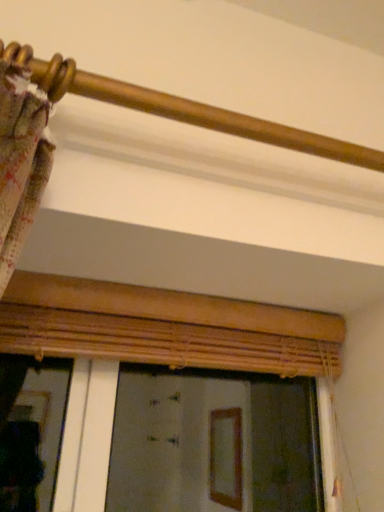
What is the approximate height of wooden blinds at center?

wooden blinds at center is 18.01 inches in height.

The height and width of the screenshot is (512, 384). What do you see at coordinates (165, 327) in the screenshot?
I see `wooden blinds at center` at bounding box center [165, 327].

Measure the distance between wooden blinds at center and camera.

The depth of wooden blinds at center is 82.97 centimeters.

This screenshot has height=512, width=384. In order to click on wooden blinds at center in this screenshot , I will do `click(165, 327)`.

I want to click on gold polished rod at upper center, so click(181, 108).

The width and height of the screenshot is (384, 512). Describe the element at coordinates (181, 108) in the screenshot. I see `gold polished rod at upper center` at that location.

Find the location of a particular element. wooden blinds at center is located at coordinates (165, 327).

Based on the photo, considering the relative positions of wooden blinds at center and gold polished rod at upper center in the image provided, is wooden blinds at center to the left of gold polished rod at upper center from the viewer's perspective?

Yes, wooden blinds at center is to the left of gold polished rod at upper center.

Considering the positions of objects wooden blinds at center and gold polished rod at upper center in the image provided, who is in front, wooden blinds at center or gold polished rod at upper center?

gold polished rod at upper center is closer to the camera.

Is point (264, 314) positioned behind point (332, 154)?

Yes, point (264, 314) is behind point (332, 154).

From the image's perspective, is wooden blinds at center under gold polished rod at upper center?

Indeed, from the image's perspective, wooden blinds at center is shown beneath gold polished rod at upper center.

From a real-world perspective, between wooden blinds at center and gold polished rod at upper center, who is vertically higher?

In real-world perspective, gold polished rod at upper center is above.

Does wooden blinds at center have a greater width compared to gold polished rod at upper center?

Correct, the width of wooden blinds at center exceeds that of gold polished rod at upper center.

Can you confirm if wooden blinds at center is taller than gold polished rod at upper center?

Correct, wooden blinds at center is much taller as gold polished rod at upper center.

Considering the relative sizes of wooden blinds at center and gold polished rod at upper center in the image provided, is wooden blinds at center smaller than gold polished rod at upper center?

No, wooden blinds at center is not smaller than gold polished rod at upper center.

In the scene shown: Is gold polished rod at upper center surrounded by wooden blinds at center?

No, gold polished rod at upper center is not inside wooden blinds at center.

Would you say wooden blinds at center is a long distance from gold polished rod at upper center?

No.

Is wooden blinds at center oriented away from gold polished rod at upper center?

wooden blinds at center is not turned away from gold polished rod at upper center.

What's the angular difference between wooden blinds at center and gold polished rod at upper center's facing directions?

wooden blinds at center and gold polished rod at upper center are facing 1.27 degrees away from each other.

Measure the distance between wooden blinds at center and gold polished rod at upper center.

A distance of 17.40 inches exists between wooden blinds at center and gold polished rod at upper center.

At what (x,y) coordinates should I click in order to perform the action: click on rail that appears in front of the wooden blinds at center. Please return your answer as a coordinate pair (x, y). Looking at the image, I should click on (181, 108).

Does gold polished rod at upper center appear on the right side of wooden blinds at center?

Yes.

Which object is closer to the camera taking this photo, gold polished rod at upper center or wooden blinds at center?

Positioned in front is gold polished rod at upper center.

Does point (269, 131) come behind point (165, 344)?

No, (269, 131) is in front of (165, 344).

From the image's perspective, who appears lower, gold polished rod at upper center or wooden blinds at center?

wooden blinds at center.

From a real-world perspective, between gold polished rod at upper center and wooden blinds at center, who is vertically lower?

In real-world perspective, wooden blinds at center is lower.

Between gold polished rod at upper center and wooden blinds at center, which one has smaller width?

With smaller width is gold polished rod at upper center.

Can you confirm if gold polished rod at upper center is shorter than wooden blinds at center?

Indeed, gold polished rod at upper center has a lesser height compared to wooden blinds at center.

Does gold polished rod at upper center have a smaller size compared to wooden blinds at center?

Correct, gold polished rod at upper center occupies less space than wooden blinds at center.

In the scene shown: Do you think gold polished rod at upper center is within wooden blinds at center, or outside of it?

gold polished rod at upper center is spatially situated outside wooden blinds at center.

In the scene shown: Is gold polished rod at upper center placed right next to wooden blinds at center?

gold polished rod at upper center is not next to wooden blinds at center, and they're not touching.

Is gold polished rod at upper center facing towards wooden blinds at center?

No, gold polished rod at upper center is not facing towards wooden blinds at center.

This screenshot has height=512, width=384. I want to click on window below the gold polished rod at upper center (from a real-world perspective), so click(x=165, y=327).

Where is `rail above the wooden blinds at center (from a real-world perspective)`? Image resolution: width=384 pixels, height=512 pixels. rail above the wooden blinds at center (from a real-world perspective) is located at coordinates (181, 108).

This screenshot has height=512, width=384. Identify the location of rail in front of the wooden blinds at center. (181, 108).